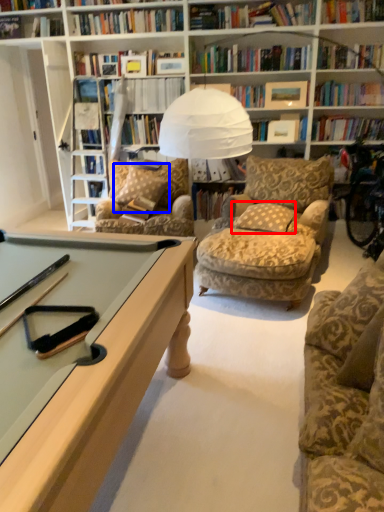
Question: Among these objects, which one is farthest to the camera, pillow (highlighted by a red box) or pillow (highlighted by a blue box)?

Choices:
 (A) pillow
 (B) pillow

Answer: (B)